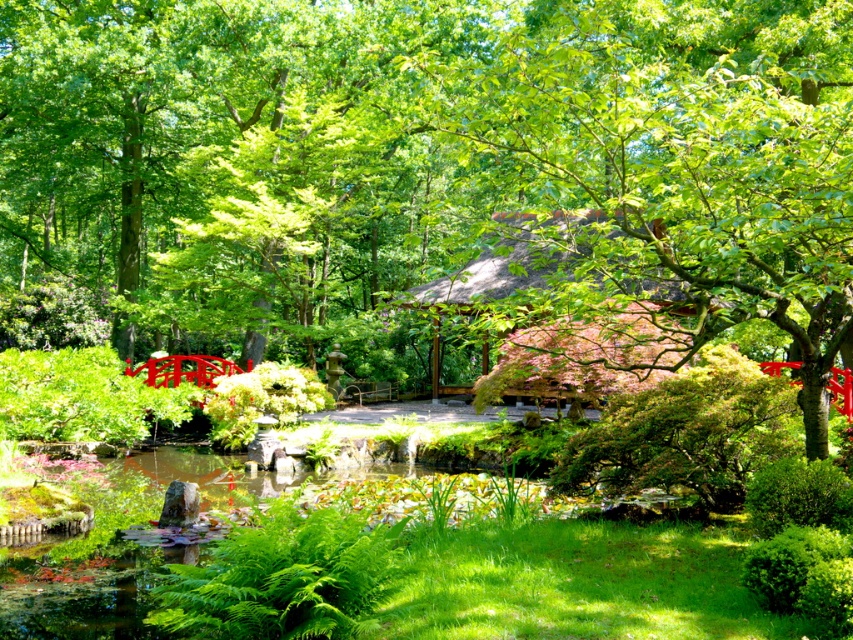
You are a visitor in the Japanese garden and want to take a photo of the thatched roof hut at center. However, you notice a green leafy fern at lower center blocking your view. Based on their positions, can you determine if the fern is in front of or behind the hut?

The green leafy fern at lower center is below thatched roof hut at center, so it is positioned in front of the hut and blocking the view.

You are a visitor in the Japanese garden and want to take a photo of the thatched roof hut at center without the green leafy tree at center blocking the view. Is there a position where you can stand to achieve this?

The green leafy tree at center is in front of the thatched roof hut at center, so you would need to move to a position where you can see behind the tree to capture the hut without obstruction. However, since the tree is directly in front, it may be challenging to fully avoid the obstruction without moving around the tree or finding an elevated viewpoint.

You are standing in the Japanese garden and see two points marked in the scene. Which point is closer to you, point (434, 352) or point (608, 308)?

Point (434, 352) is closer to you because it is further to the viewer than point (608, 308).